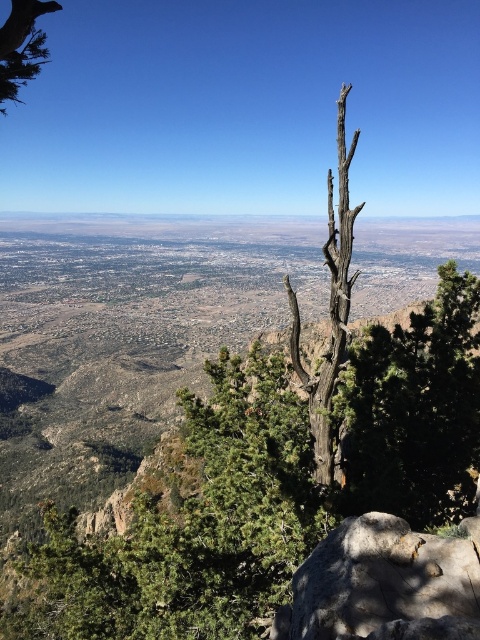
You are a hiker standing at the base of the dark brown bark tree at center and want to take a photo of the green matte tree at upper left. Which tree should you focus on first to ensure both are in the frame?

You should focus on the dark brown bark tree at center first because it is closer to you than the green matte tree at upper left, so adjusting the camera to include both would require framing from the closer object outward.

You are a hiker standing at the point marked by coordinates (272, 486) in the image. Describe the immediate surroundings of your location based on the scene description.

The point at coordinates (272, 486) is located on the dark brown bark tree at center, which has twisted branches and is surrounded by patches of evergreen foliage like pine trees.